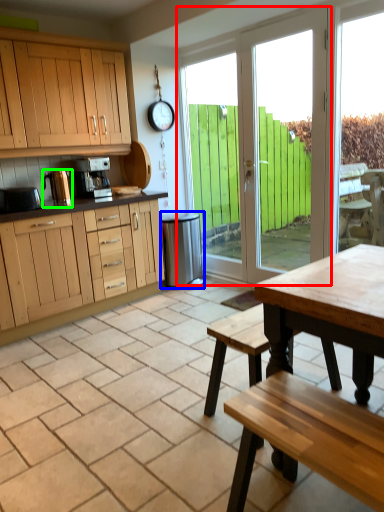
Question: Estimate the real-world distances between objects in this image. Which object is closer to door (highlighted by a red box), appliance (highlighted by a blue box) or appliance (highlighted by a green box)?

Choices:
 (A) appliance
 (B) appliance

Answer: (A)